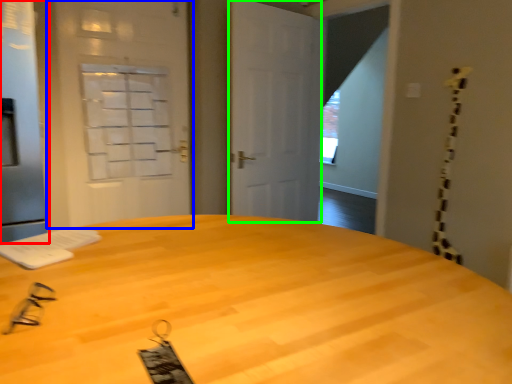
Question: Considering the real-world distances, which object is closest to screen door (highlighted by a red box)? screen door (highlighted by a blue box) or door (highlighted by a green box).

Choices:
 (A) screen door
 (B) door

Answer: (A)